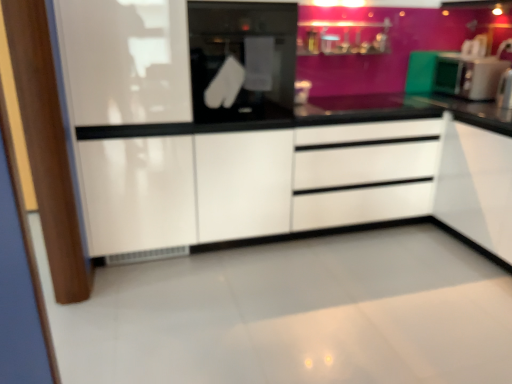
Question: In the image, is black glass oven at center on the left side or the right side of white glossy cabinet at center?

Choices:
 (A) left
 (B) right

Answer: (B)

Question: From the image's perspective, is black glass oven at center positioned above or below white glossy cabinet at center?

Choices:
 (A) above
 (B) below

Answer: (A)

Question: Based on their relative distances, which object is farther from the green matte microwave at right?

Choices:
 (A) white glossy cabinet at center
 (B) black glass oven at center
 (C) white glossy drawer at center

Answer: (B)

Question: Which object is the farthest from the black glass oven at center?

Choices:
 (A) white glossy drawer at center
 (B) green matte microwave at right
 (C) white glossy cabinet at center

Answer: (B)